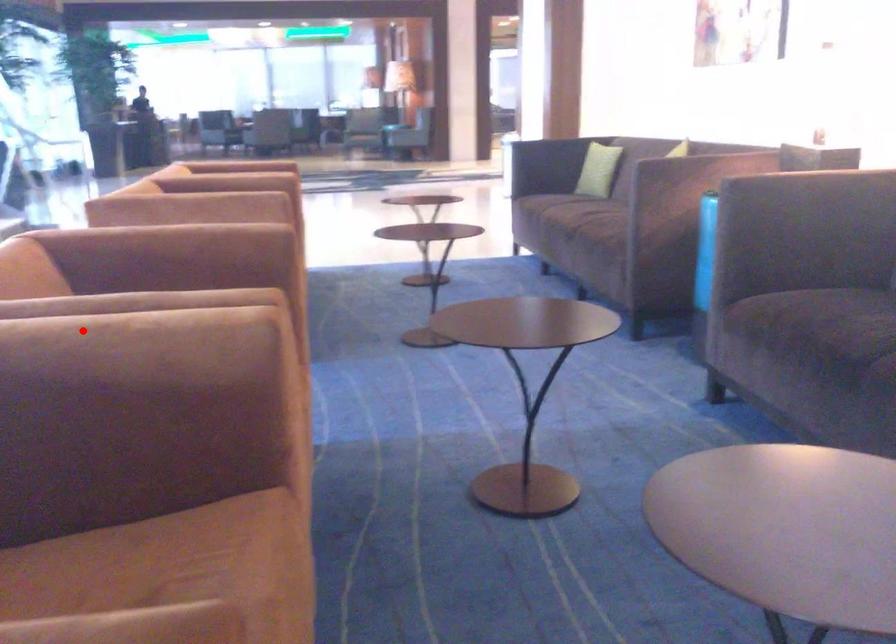
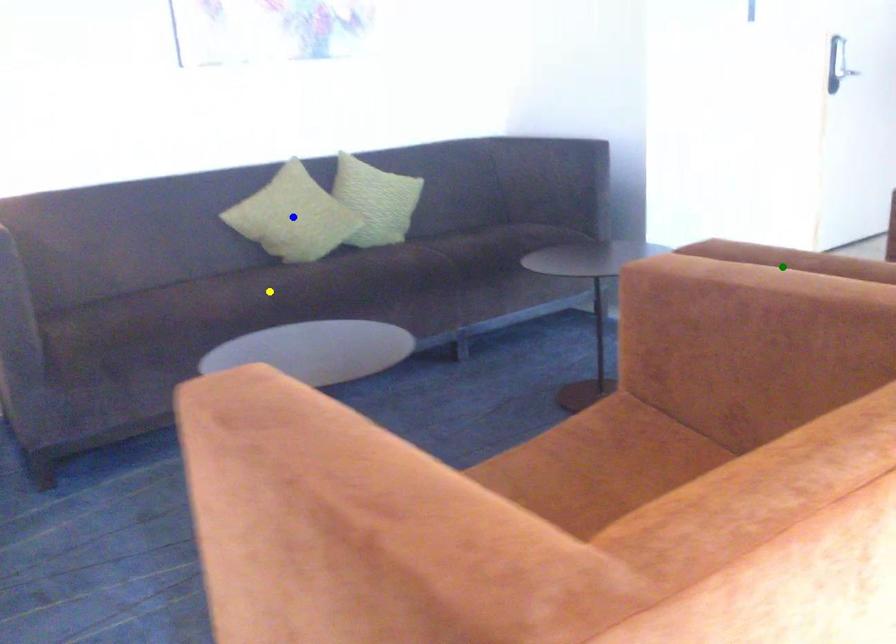
Question: I am providing you with two images of the same scene from different viewpoints. A red point is marked on the first image. You are given multiple points on the second image. Which point in image 2 represents the same 3d spot as the red point in image 1?

Choices:
 (A) yellow point
 (B) blue point
 (C) green point

Answer: (C)